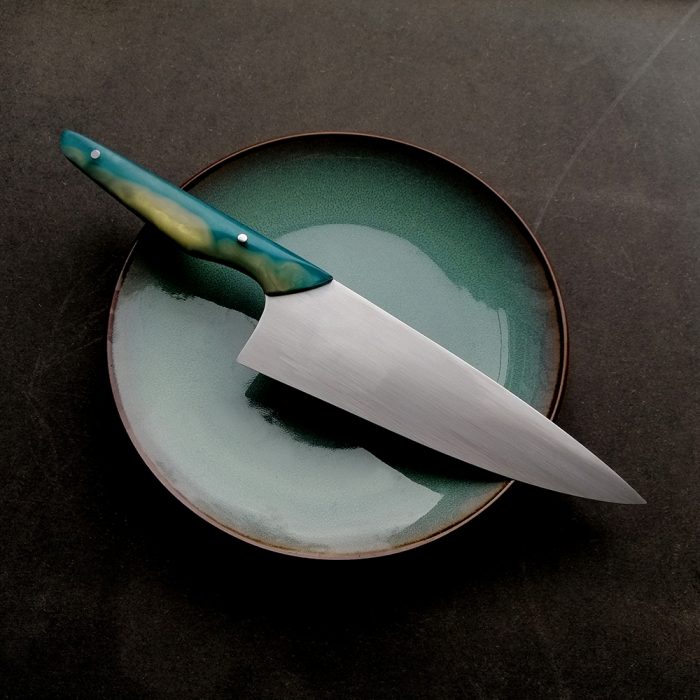
This screenshot has width=700, height=700. Identify the location of plate. (428, 287).